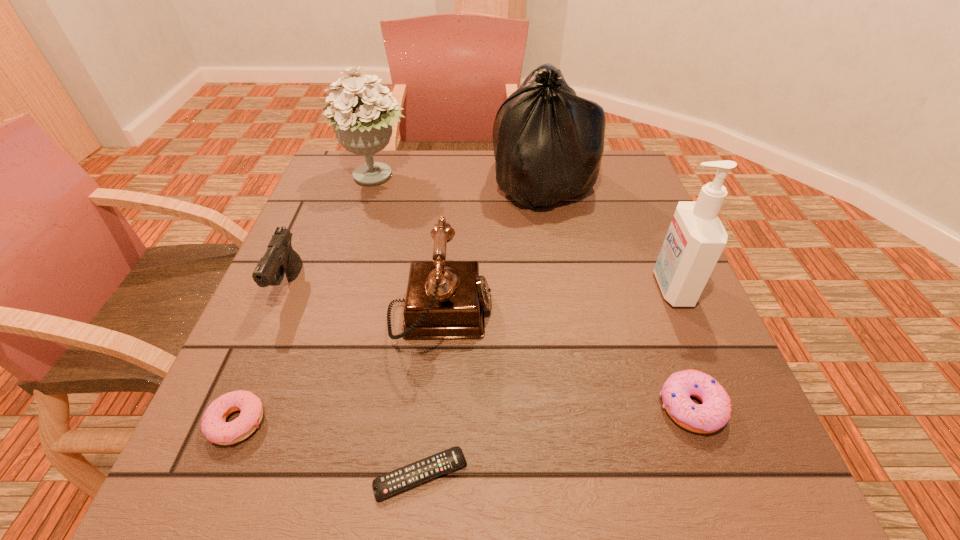
Find the location of a particular element. The width and height of the screenshot is (960, 540). vacant space that is in between the pistol and the fourth tallest object is located at coordinates (365, 301).

The height and width of the screenshot is (540, 960). Identify the location of free point between the shorter doughnut and the remote control. (329, 448).

Find the location of a particular element. This screenshot has width=960, height=540. free space between the shorter doughnut and the bouquet is located at coordinates (307, 300).

Locate an element on the screen. blank region between the fifth shortest object and the shortest object is located at coordinates (430, 395).

Find the location of a particular element. This screenshot has width=960, height=540. free space between the fifth tallest object and the remote control is located at coordinates (355, 381).

This screenshot has width=960, height=540. Identify the location of free point between the shortest object and the bouquet. (398, 326).

This screenshot has height=540, width=960. I want to click on blank region between the fifth tallest object and the remote control, so click(x=355, y=381).

Image resolution: width=960 pixels, height=540 pixels. What are the coordinates of `vacant region between the bouquet and the pistol` in the screenshot? It's located at (332, 232).

At what (x,y) coordinates should I click in order to perform the action: click on free spot between the right doughnut and the seventh tallest object. Please return your answer as a coordinate pair (x, y). Looking at the image, I should click on (465, 415).

Select which object is the sixth closest to the telephone. Please provide its 2D coordinates. Your answer should be formatted as a tuple, i.e. [(x, y)], where the tuple contains the x and y coordinates of a point satisfying the conditions above.

[(363, 122)]